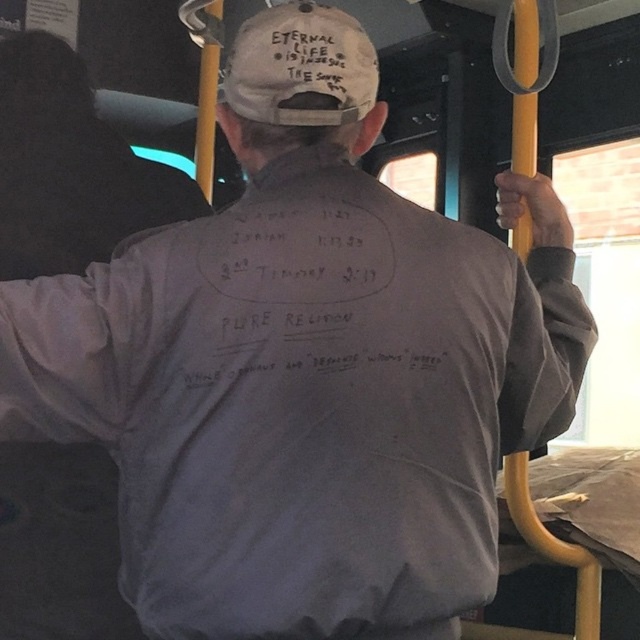
Does point (99, 140) lie in front of point (336, 10)?

No, it is behind (336, 10).

Does gray cotton sweatshirt at upper left have a greater width compared to white fabric cap at upper center?

Yes.

Who is more forward, (90, 138) or (314, 42)?

Point (314, 42) is more forward.

Identify the location of gray cotton sweatshirt at upper left. This screenshot has height=640, width=640. (68, 168).